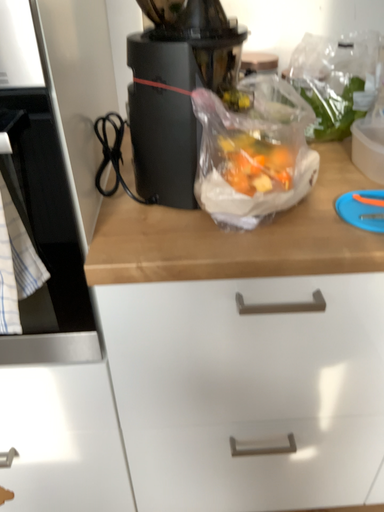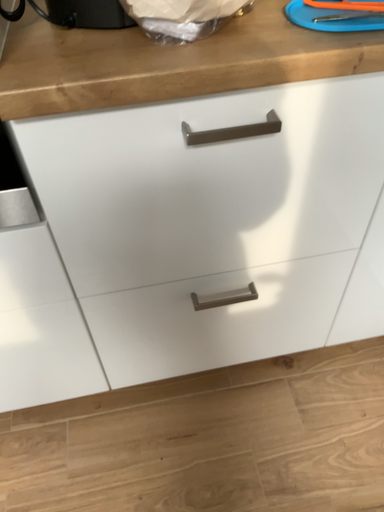
Question: How did the camera likely rotate when shooting the video?

Choices:
 (A) rotated right
 (B) rotated left

Answer: (A)